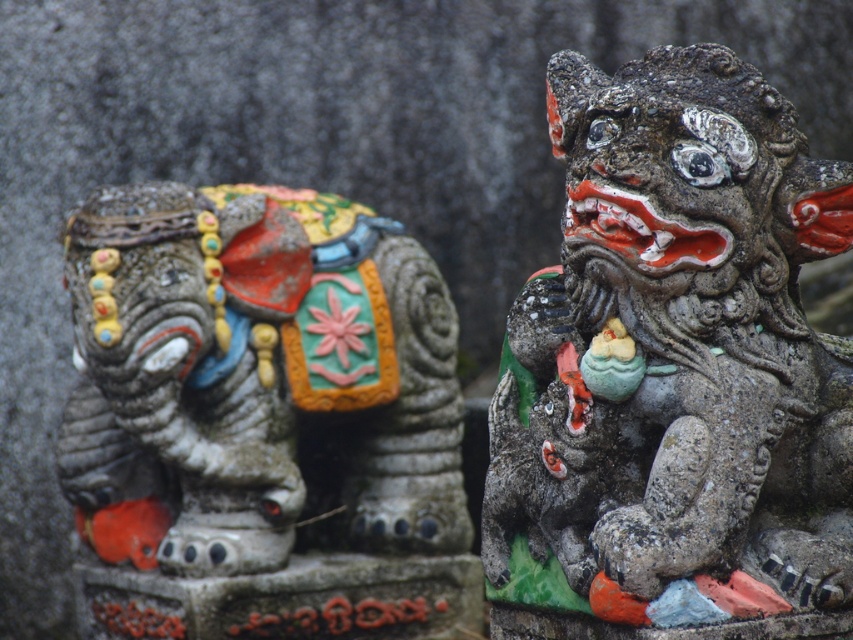
Question: Among these points, which one is farthest from the camera?

Choices:
 (A) (149, 412)
 (B) (596, 362)

Answer: (A)

Question: Which point is farther to the camera?

Choices:
 (A) stone lion at right
 (B) matte stone elephant at left

Answer: (B)

Question: Does stone lion at right come behind matte stone elephant at left?

Choices:
 (A) no
 (B) yes

Answer: (A)

Question: Observing the image, what is the correct spatial positioning of stone lion at right in reference to matte stone elephant at left?

Choices:
 (A) left
 (B) right

Answer: (B)

Question: Can you confirm if stone lion at right is positioned above matte stone elephant at left?

Choices:
 (A) no
 (B) yes

Answer: (B)